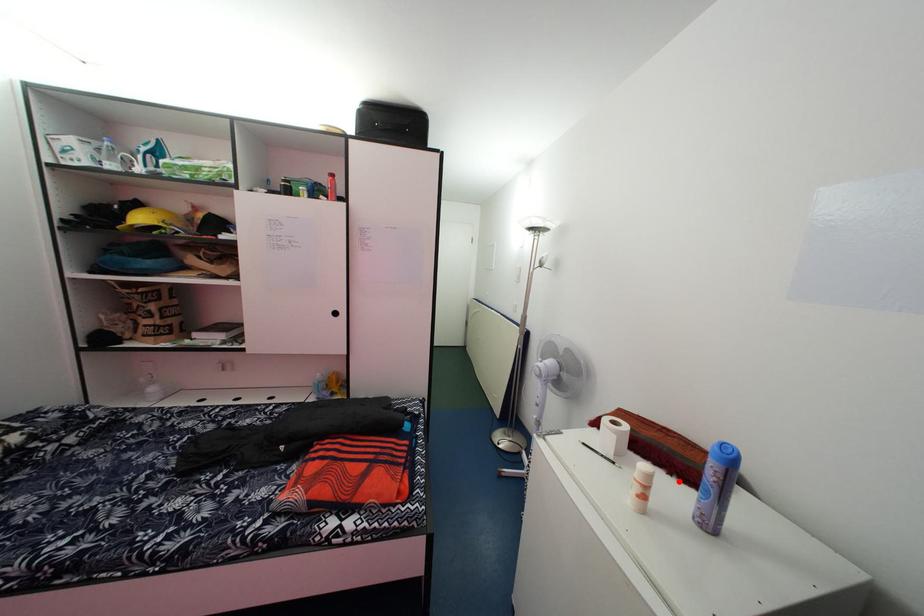
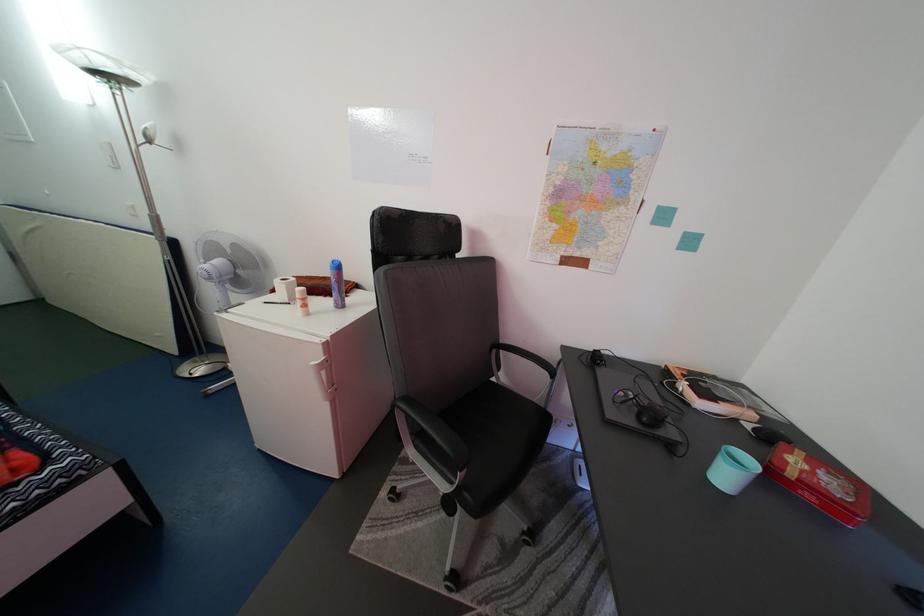
Locate, in the second image, the point that corresponds to the highlighted location in the first image.

(334, 304)